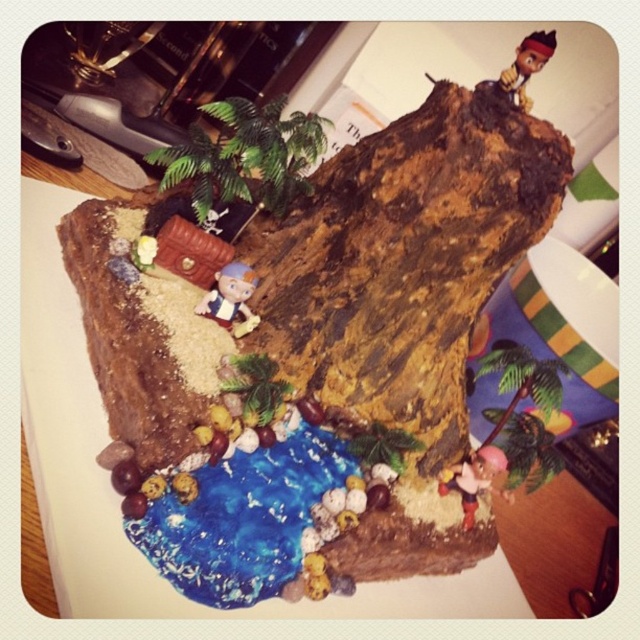
This screenshot has width=640, height=640. Identify the location of brown sugar pirate ship at center. (321, 352).

Measure the distance between brown sugar pirate ship at center and smooth brown figurine at upper right.

brown sugar pirate ship at center is 16.87 inches away from smooth brown figurine at upper right.

Where is `brown sugar pirate ship at center`? This screenshot has height=640, width=640. brown sugar pirate ship at center is located at coordinates (321, 352).